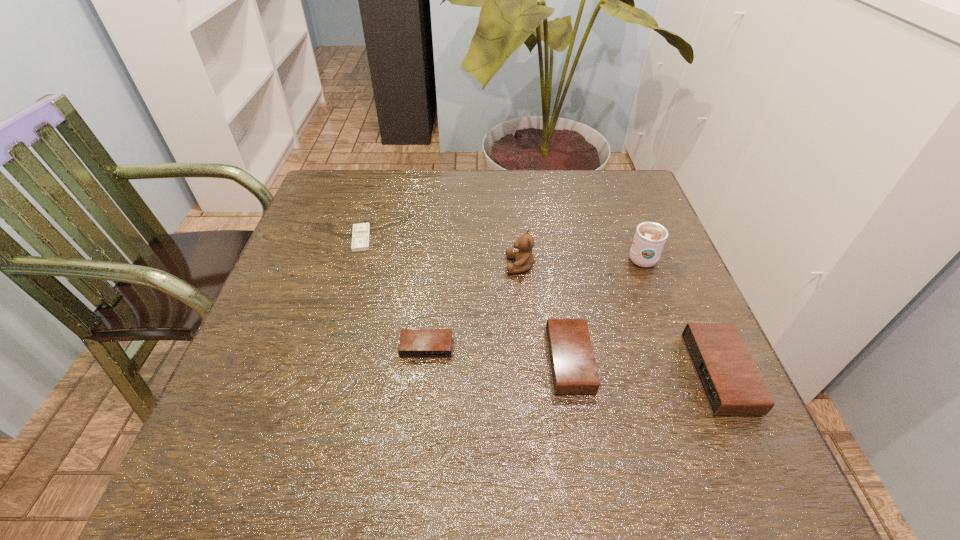
Locate an element on the screen. The height and width of the screenshot is (540, 960). vacant space located on the side with the handle of the tallest object is located at coordinates (624, 211).

I want to click on object located in the left edge section of the desktop, so click(x=361, y=232).

Locate an element on the screen. This screenshot has height=540, width=960. alarm clock that is at the right edge is located at coordinates (732, 385).

This screenshot has width=960, height=540. What are the coordinates of `cup that is positioned at the right edge` in the screenshot? It's located at (650, 237).

Where is `object located at the near right corner`? object located at the near right corner is located at coordinates (732, 385).

In the image, there is a desktop. Where is `vacant area at the far edge`? vacant area at the far edge is located at coordinates (444, 179).

In the image, there is a desktop. In order to click on vacant space at the near edge in this screenshot , I will do `click(497, 392)`.

The image size is (960, 540). I want to click on vacant region at the left edge of the desktop, so click(347, 224).

Locate an element on the screen. free space at the right edge of the desktop is located at coordinates (615, 222).

Where is `vacant space at the far left corner`? This screenshot has width=960, height=540. vacant space at the far left corner is located at coordinates (372, 204).